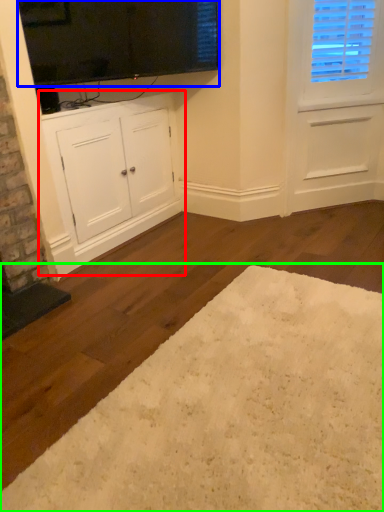
Question: Which object is the farthest from cabinetry (highlighted by a red box)? Choose among these: window screen (highlighted by a blue box) or plain (highlighted by a green box).

Choices:
 (A) window screen
 (B) plain

Answer: (B)